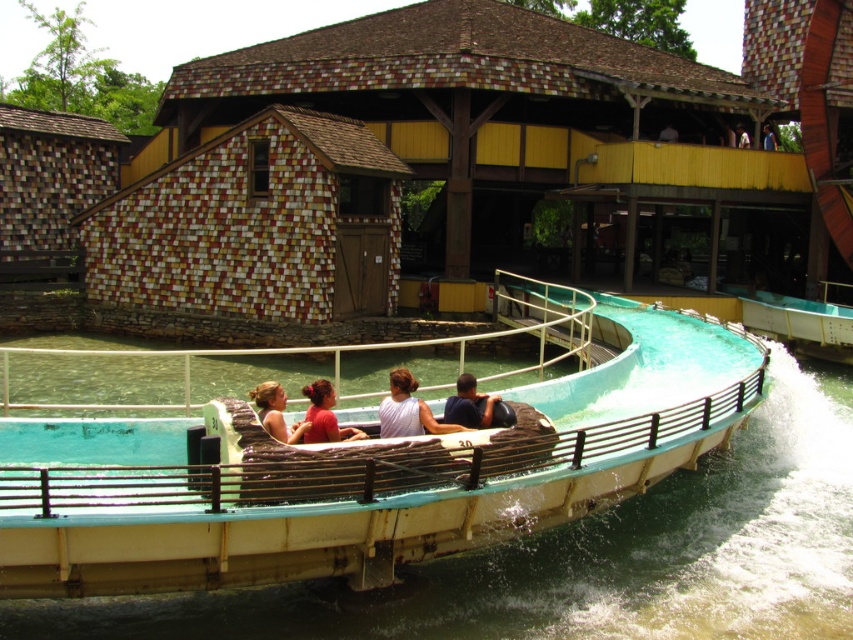
Question: Can you confirm if matte white tank top at center is positioned to the right of matte brown hair at center?

Choices:
 (A) yes
 (B) no

Answer: (A)

Question: Does teal rubber boat at center appear over blue fabric shirt at upper center?

Choices:
 (A) yes
 (B) no

Answer: (B)

Question: Considering the relative positions of teal rubber boat at center and matte white tank top at center in the image provided, where is teal rubber boat at center located with respect to matte white tank top at center?

Choices:
 (A) above
 (B) below

Answer: (A)

Question: Which of the following is the closest to the observer?

Choices:
 (A) white fabric person at upper center
 (B) dark blue fabric at center

Answer: (B)

Question: Which object appears farthest from the camera in this image?

Choices:
 (A) red matte shirt at center
 (B) teal rubber boat at center
 (C) matte brown hair at center

Answer: (A)

Question: Among these objects, which one is nearest to the camera?

Choices:
 (A) dark blue fabric at center
 (B) blue fabric shirt at upper center
 (C) red matte shirt at center
 (D) matte white tank top at center

Answer: (C)